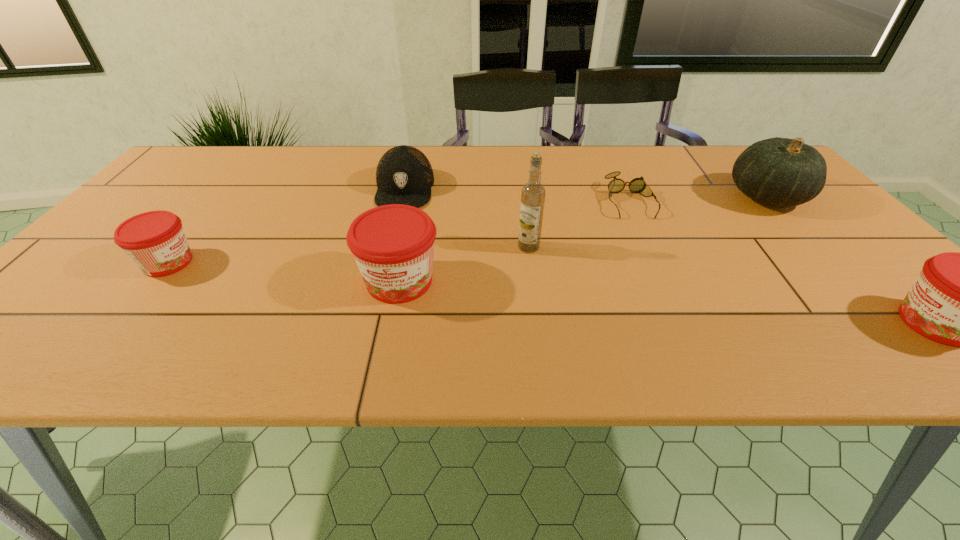
You are a GUI agent. You are given a task and a screenshot of the screen. Output one action in this format:
    pyautogui.click(x=<x>, y=<y>)
    Task: Click on the vacant space that is in between the shortest jam and the second jam from right to left
    The width and height of the screenshot is (960, 540).
    Given the screenshot: What is the action you would take?
    pyautogui.click(x=283, y=272)

I want to click on vacant area that lies between the leftmost jam and the cap, so click(x=286, y=226).

The width and height of the screenshot is (960, 540). I want to click on vacant point located between the second jam from left to right and the fourth object from right to left, so click(464, 264).

Select which object is the closest to the fourth object from right to left. Please provide its 2D coordinates. Your answer should be formatted as a tuple, i.e. [(x, y)], where the tuple contains the x and y coordinates of a point satisfying the conditions above.

[(393, 245)]

Identify which object is located as the fourth nearest to the spectacles. Please provide its 2D coordinates. Your answer should be formatted as a tuple, i.e. [(x, y)], where the tuple contains the x and y coordinates of a point satisfying the conditions above.

[(959, 299)]

Identify which jam is the second nearest to the gourd. Please provide its 2D coordinates. Your answer should be formatted as a tuple, i.e. [(x, y)], where the tuple contains the x and y coordinates of a point satisfying the conditions above.

[(393, 245)]

Where is `the closest jam to the tallest object`? The image size is (960, 540). the closest jam to the tallest object is located at coordinates (393, 245).

Image resolution: width=960 pixels, height=540 pixels. Identify the location of vacant space that satisfies the following two spatial constraints: 1. on the front-facing side of the spectacles; 2. on the label side of the leftmost jam. (658, 262).

The width and height of the screenshot is (960, 540). What are the coordinates of `blank area in the image that satisfies the following two spatial constraints: 1. on the front-facing side of the gourd; 2. on the right side of the cap` in the screenshot? It's located at (402, 197).

In order to click on free space that satisfies the following two spatial constraints: 1. on the front-facing side of the third object from right to left; 2. on the label side of the shortest jam in this screenshot , I will do `click(658, 262)`.